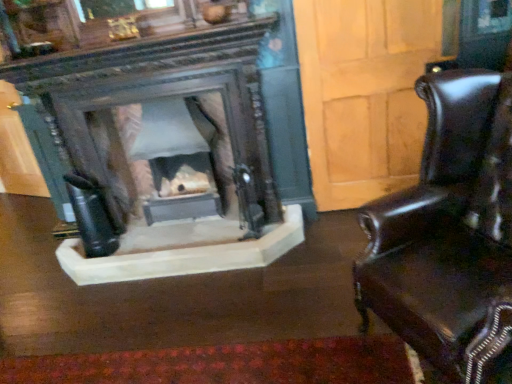
Describe the element at coordinates (174, 158) in the screenshot. I see `smooth stone fireplace at center` at that location.

Locate an element on the screen. This screenshot has height=384, width=512. smooth stone fireplace at center is located at coordinates (174, 158).

Locate an element on the screen. The image size is (512, 384). shiny brown leather chair at right is located at coordinates (449, 234).

Describe the element at coordinates (449, 234) in the screenshot. This screenshot has width=512, height=384. I see `shiny brown leather chair at right` at that location.

Locate an element on the screen. smooth stone fireplace at center is located at coordinates (174, 158).

Does shiny brown leather chair at right appear on the left side of smooth stone fireplace at center?

In fact, shiny brown leather chair at right is to the right of smooth stone fireplace at center.

Based on the photo, does shiny brown leather chair at right lie behind smooth stone fireplace at center?

No, shiny brown leather chair at right is in front of smooth stone fireplace at center.

Considering the positions of points (407, 304) and (163, 99), is point (407, 304) farther from camera compared to point (163, 99)?

No, (407, 304) is closer to viewer.

From the image's perspective, does shiny brown leather chair at right appear higher than smooth stone fireplace at center?

Actually, shiny brown leather chair at right appears below smooth stone fireplace at center in the image.

From a real-world perspective, is shiny brown leather chair at right physically above smooth stone fireplace at center?

Yes, from a real-world perspective, shiny brown leather chair at right is above smooth stone fireplace at center.

Does shiny brown leather chair at right have a lesser width compared to smooth stone fireplace at center?

No.

Between shiny brown leather chair at right and smooth stone fireplace at center, which one has more height?

shiny brown leather chair at right.

Does shiny brown leather chair at right have a smaller size compared to smooth stone fireplace at center?

Incorrect, shiny brown leather chair at right is not smaller in size than smooth stone fireplace at center.

Would you say shiny brown leather chair at right is outside smooth stone fireplace at center?

shiny brown leather chair at right is positioned outside smooth stone fireplace at center.

Are shiny brown leather chair at right and smooth stone fireplace at center far apart?

Yes, shiny brown leather chair at right and smooth stone fireplace at center are located far from each other.

Is shiny brown leather chair at right looking in the opposite direction of smooth stone fireplace at center?

That's not correct — shiny brown leather chair at right is not looking away from smooth stone fireplace at center.

Image resolution: width=512 pixels, height=384 pixels. I want to click on fireplace that is under the shiny brown leather chair at right (from a real-world perspective), so click(x=174, y=158).

Between smooth stone fireplace at center and shiny brown leather chair at right, which one appears on the left side from the viewer's perspective?

From the viewer's perspective, smooth stone fireplace at center appears more on the left side.

Who is more distant, smooth stone fireplace at center or shiny brown leather chair at right?

smooth stone fireplace at center is further away from the camera.

Which is behind, point (206, 122) or point (446, 259)?

Point (206, 122)

From the image's perspective, between smooth stone fireplace at center and shiny brown leather chair at right, which one is located above?

From the image's view, smooth stone fireplace at center is above.

From a real-world perspective, is smooth stone fireplace at center physically located above or below shiny brown leather chair at right?

smooth stone fireplace at center is below shiny brown leather chair at right.

Which of these two, smooth stone fireplace at center or shiny brown leather chair at right, is wider?

With larger width is shiny brown leather chair at right.

Looking at this image, from their relative heights in the image, would you say smooth stone fireplace at center is taller or shorter than shiny brown leather chair at right?

smooth stone fireplace at center is shorter than shiny brown leather chair at right.

Does smooth stone fireplace at center have a smaller size compared to shiny brown leather chair at right?

Yes.

Is shiny brown leather chair at right a part of smooth stone fireplace at center?

No, shiny brown leather chair at right is not surrounded by smooth stone fireplace at center.

Is there a large distance between smooth stone fireplace at center and shiny brown leather chair at right?

smooth stone fireplace at center is far away from shiny brown leather chair at right.

Is smooth stone fireplace at center positioned with its back to shiny brown leather chair at right?

No, smooth stone fireplace at center is not facing the opposite direction of shiny brown leather chair at right.

Based on the photo, can you tell me how much smooth stone fireplace at center and shiny brown leather chair at right differ in facing direction?

The facing directions of smooth stone fireplace at center and shiny brown leather chair at right are 61.7 degrees apart.

How far apart are smooth stone fireplace at center and shiny brown leather chair at right?

A distance of 1.67 meters exists between smooth stone fireplace at center and shiny brown leather chair at right.

Find the location of a particular element. fireplace above the shiny brown leather chair at right (from the image's perspective) is located at coordinates (174, 158).

Locate an element on the screen. The width and height of the screenshot is (512, 384). chair on the right side of smooth stone fireplace at center is located at coordinates (449, 234).

Image resolution: width=512 pixels, height=384 pixels. What are the coordinates of `fireplace below the shiny brown leather chair at right (from a real-world perspective)` in the screenshot? It's located at (174, 158).